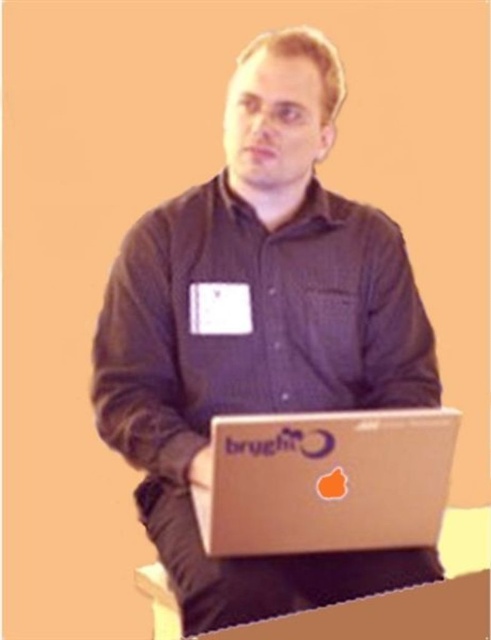
Which is in front, point (413, 340) or point (159, 580)?

Point (413, 340)

The height and width of the screenshot is (640, 491). Identify the location of matte black laptop at center. (258, 332).

Does point (280, 316) lie in front of point (437, 532)?

No.

Does point (246, 396) lie behind point (278, 497)?

That is True.

The width and height of the screenshot is (491, 640). Find the location of `matte black laptop at center`. matte black laptop at center is located at coordinates (258, 332).

Is silver metallic laptop at center positioned at the back of cardboard at lower center?

No, it is in front of cardboard at lower center.

Who is positioned more to the left, silver metallic laptop at center or cardboard at lower center?

cardboard at lower center

The image size is (491, 640). I want to click on silver metallic laptop at center, so click(325, 481).

Where is `silver metallic laptop at center`? This screenshot has height=640, width=491. silver metallic laptop at center is located at coordinates (325, 481).